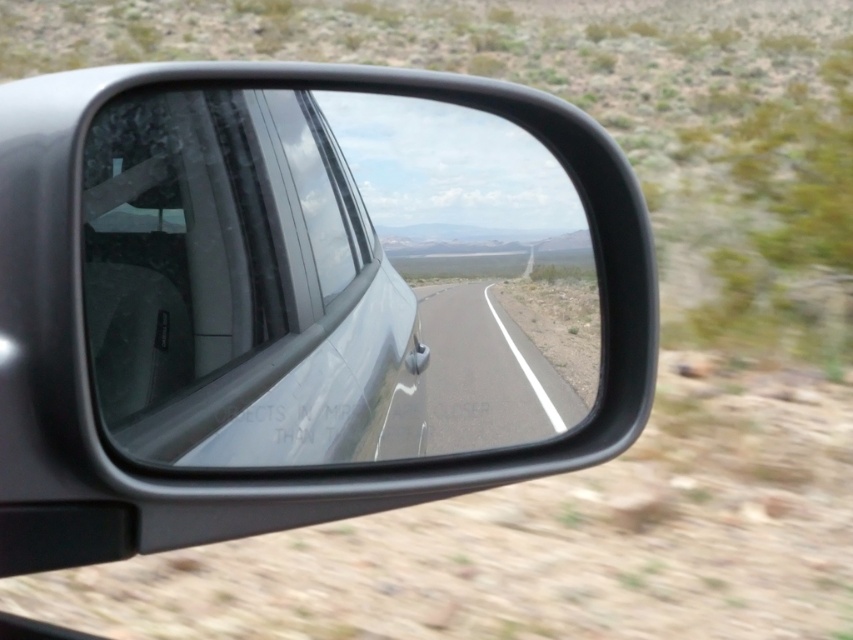
Between point (247, 381) and point (537, 396), which one is positioned in front?

Point (247, 381)

Can you confirm if clear glass window at center is thinner than asphalt road at center?

In fact, clear glass window at center might be wider than asphalt road at center.

Between point (173, 360) and point (469, 282), which one is positioned in front?

Point (173, 360) is in front.

This screenshot has width=853, height=640. I want to click on clear glass window at center, so click(x=235, y=284).